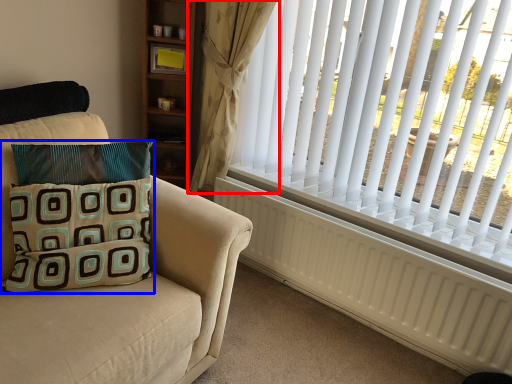
Question: Which object is further to the camera taking this photo, curtain (highlighted by a red box) or pillow (highlighted by a blue box)?

Choices:
 (A) curtain
 (B) pillow

Answer: (A)